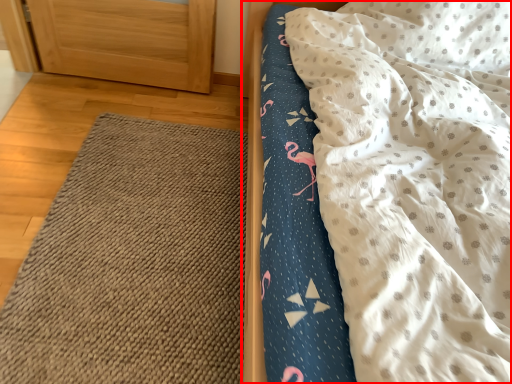
Question: From the image's perspective, where is bed (annotated by the red box) located in relation to mat in the image?

Choices:
 (A) above
 (B) below

Answer: (A)